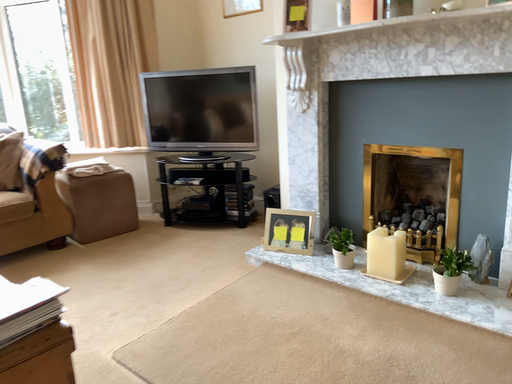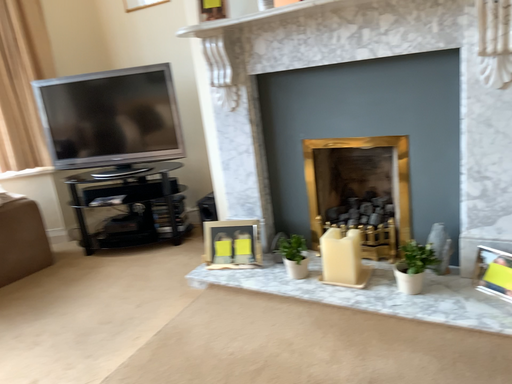
Question: Which way did the camera rotate in the video?

Choices:
 (A) rotated left
 (B) rotated right

Answer: (B)